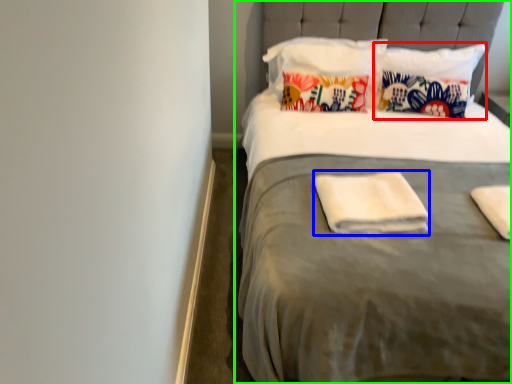
Question: Considering the real-world distances, which object is farthest from pillow (highlighted by a red box)? material (highlighted by a blue box) or bed (highlighted by a green box)?

Choices:
 (A) material
 (B) bed

Answer: (A)